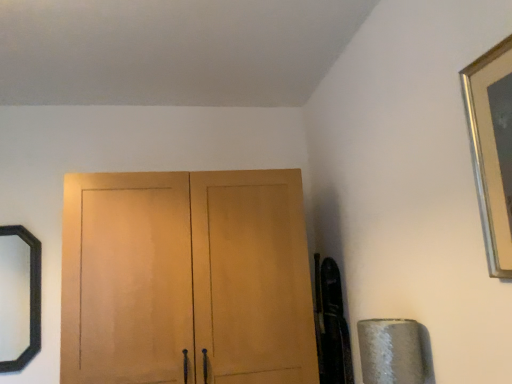
Describe the element at coordinates (30, 298) in the screenshot. I see `black glass mirror at left` at that location.

Locate an element on the screen. Image resolution: width=512 pixels, height=384 pixels. black glass mirror at left is located at coordinates (30, 298).

Identify the location of black glass mirror at left. (30, 298).